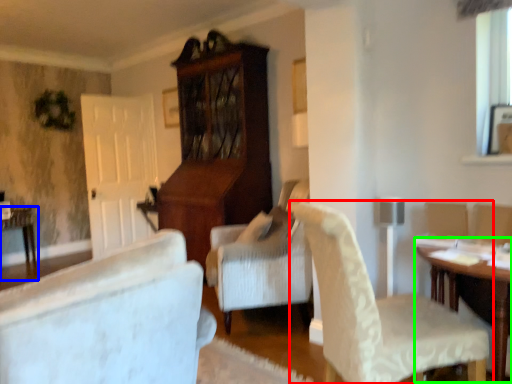
Question: Considering the real-world distances, which object is closest to chair (highlighted by a red box)? table (highlighted by a blue box) or table (highlighted by a green box).

Choices:
 (A) table
 (B) table

Answer: (B)